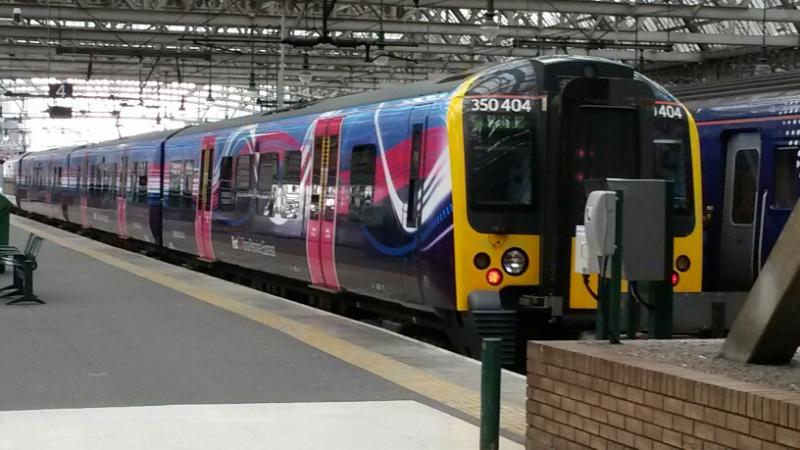
The height and width of the screenshot is (450, 800). In order to click on telephone in this screenshot , I will do `click(594, 238)`.